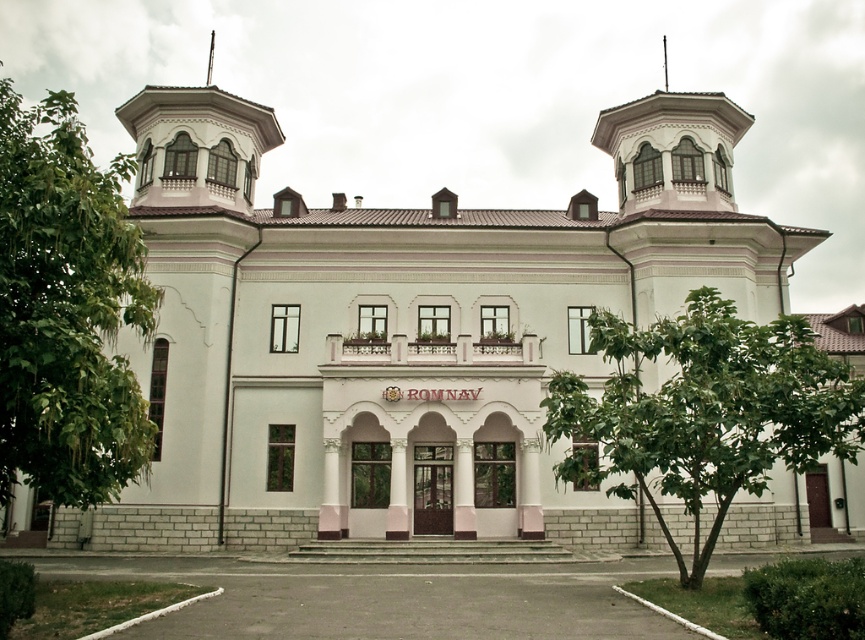
Question: Considering the relative positions of green leafy tree at left and green leafy tree at center in the image provided, where is green leafy tree at left located with respect to green leafy tree at center?

Choices:
 (A) above
 (B) below

Answer: (A)

Question: Which point is farther to the camera?

Choices:
 (A) green leafy tree at center
 (B) green leafy tree at left

Answer: (A)

Question: In this image, where is green leafy tree at left located relative to green leafy tree at center?

Choices:
 (A) left
 (B) right

Answer: (A)

Question: Is green leafy tree at left to the right of green leafy tree at center from the viewer's perspective?

Choices:
 (A) yes
 (B) no

Answer: (B)